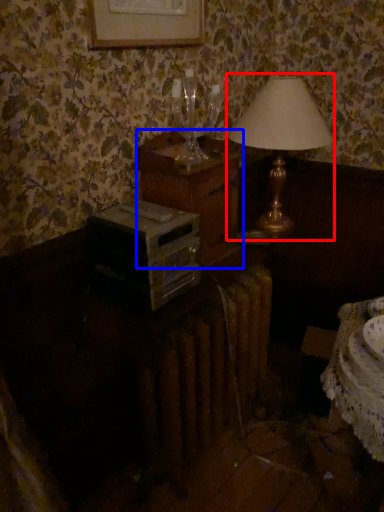
Question: Among these objects, which one is nearest to the camera, lamp (highlighted by a red box) or nightstand (highlighted by a blue box)?

Choices:
 (A) lamp
 (B) nightstand

Answer: (B)